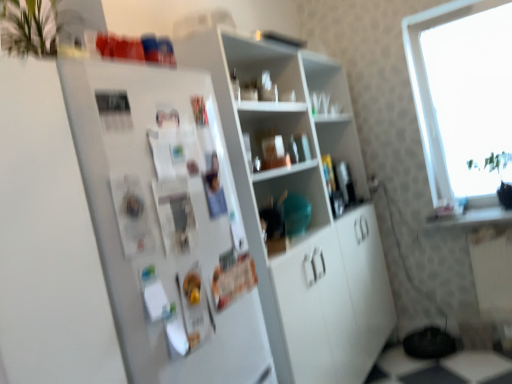
Question: Considering the relative sizes of white glossy cabinet at center, which appears as the third shelf when viewed from the top, and white matte refrigerator at left in the image provided, is white glossy cabinet at center, which appears as the third shelf when viewed from the top, bigger than white matte refrigerator at left?

Choices:
 (A) yes
 (B) no

Answer: (A)

Question: Is white glossy cabinet at center, which appears as the third shelf when viewed from the top, wider than white matte refrigerator at left?

Choices:
 (A) yes
 (B) no

Answer: (B)

Question: Is white matte refrigerator at left at the back of white glossy cabinet at center, which appears as the third shelf when viewed from the top?

Choices:
 (A) yes
 (B) no

Answer: (B)

Question: From a real-world perspective, does white glossy cabinet at center, which appears as the third shelf when viewed from the top, sit lower than white matte refrigerator at left?

Choices:
 (A) no
 (B) yes

Answer: (B)

Question: Considering the relative positions of white glossy cabinet at center, which appears as the third shelf when viewed from the top, and white matte refrigerator at left in the image provided, is white glossy cabinet at center, which appears as the third shelf when viewed from the top, to the left of white matte refrigerator at left from the viewer's perspective?

Choices:
 (A) no
 (B) yes

Answer: (A)

Question: In terms of height, does white matte refrigerator at left look taller or shorter compared to white glossy cabinet at center, which appears as the third shelf when viewed from the top?

Choices:
 (A) tall
 (B) short

Answer: (B)

Question: Is white matte refrigerator at left inside the boundaries of white glossy cabinet at center, which appears as the third shelf when viewed from the top, or outside?

Choices:
 (A) inside
 (B) outside

Answer: (B)

Question: Based on their sizes in the image, would you say white matte refrigerator at left is bigger or smaller than white glossy cabinet at center, which appears as the third shelf when viewed from the top?

Choices:
 (A) small
 (B) big

Answer: (A)

Question: From a real-world perspective, relative to white glossy cabinet at center, the first shelf ordered from the bottom, is white matte refrigerator at left vertically above or below?

Choices:
 (A) below
 (B) above

Answer: (B)

Question: From the image's perspective, is transparent glass window at upper right above or below white matte refrigerator at left?

Choices:
 (A) below
 (B) above

Answer: (B)

Question: Considering the positions of transparent glass window at upper right and white matte refrigerator at left in the image, is transparent glass window at upper right taller or shorter than white matte refrigerator at left?

Choices:
 (A) short
 (B) tall

Answer: (B)

Question: Considering the positions of transparent glass window at upper right and white matte refrigerator at left in the image, is transparent glass window at upper right bigger or smaller than white matte refrigerator at left?

Choices:
 (A) big
 (B) small

Answer: (B)

Question: From a real-world perspective, is transparent glass window at upper right positioned above or below white matte refrigerator at left?

Choices:
 (A) above
 (B) below

Answer: (A)

Question: Considering the positions of point (443, 57) and point (372, 216), is point (443, 57) closer or farther from the camera than point (372, 216)?

Choices:
 (A) farther
 (B) closer

Answer: (B)

Question: From the image's perspective, relative to white glossy cabinet at center, the first shelf ordered from the bottom, is transparent glass window at upper right above or below?

Choices:
 (A) above
 (B) below

Answer: (A)